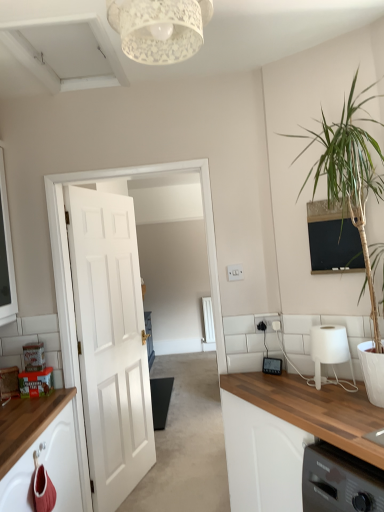
Question: Should I look upward or downward to see white glossy door at center?

Choices:
 (A) down
 (B) up

Answer: (A)

Question: From a real-world perspective, is green leafy plant at right physically above white painted wood door at left?

Choices:
 (A) no
 (B) yes

Answer: (B)

Question: From a real-world perspective, is green leafy plant at right below white painted wood door at left?

Choices:
 (A) no
 (B) yes

Answer: (A)

Question: Is green leafy plant at right oriented away from white painted wood door at left?

Choices:
 (A) no
 (B) yes

Answer: (A)

Question: Does green leafy plant at right appear on the left side of white painted wood door at left?

Choices:
 (A) yes
 (B) no

Answer: (B)

Question: Is green leafy plant at right at the right side of white painted wood door at left?

Choices:
 (A) yes
 (B) no

Answer: (A)

Question: Could you tell me if green leafy plant at right is turned towards white painted wood door at left?

Choices:
 (A) yes
 (B) no

Answer: (B)

Question: Considering the relative sizes of white lace lampshade at upper center and white glossy door at center in the image provided, is white lace lampshade at upper center wider than white glossy door at center?

Choices:
 (A) no
 (B) yes

Answer: (B)

Question: From the image's perspective, is white lace lampshade at upper center located beneath white glossy door at center?

Choices:
 (A) yes
 (B) no

Answer: (B)

Question: Is white lace lampshade at upper center bigger than white glossy door at center?

Choices:
 (A) no
 (B) yes

Answer: (A)

Question: Is white glossy door at center a part of white lace lampshade at upper center?

Choices:
 (A) no
 (B) yes

Answer: (A)

Question: Is the position of white lace lampshade at upper center less distant than that of white glossy door at center?

Choices:
 (A) no
 (B) yes

Answer: (B)

Question: Can you confirm if white lace lampshade at upper center is smaller than white glossy door at center?

Choices:
 (A) yes
 (B) no

Answer: (A)

Question: Is white painted wood door at left facing towards matte black thermostat at center?

Choices:
 (A) yes
 (B) no

Answer: (A)